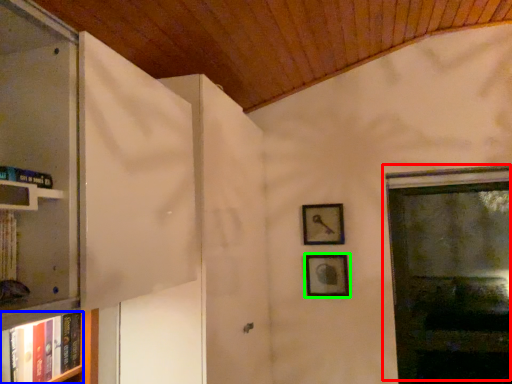
Question: Which object is positioned farthest from window (highlighted by a red box)? Select from book (highlighted by a blue box) and picture frame (highlighted by a green box).

Choices:
 (A) book
 (B) picture frame

Answer: (A)